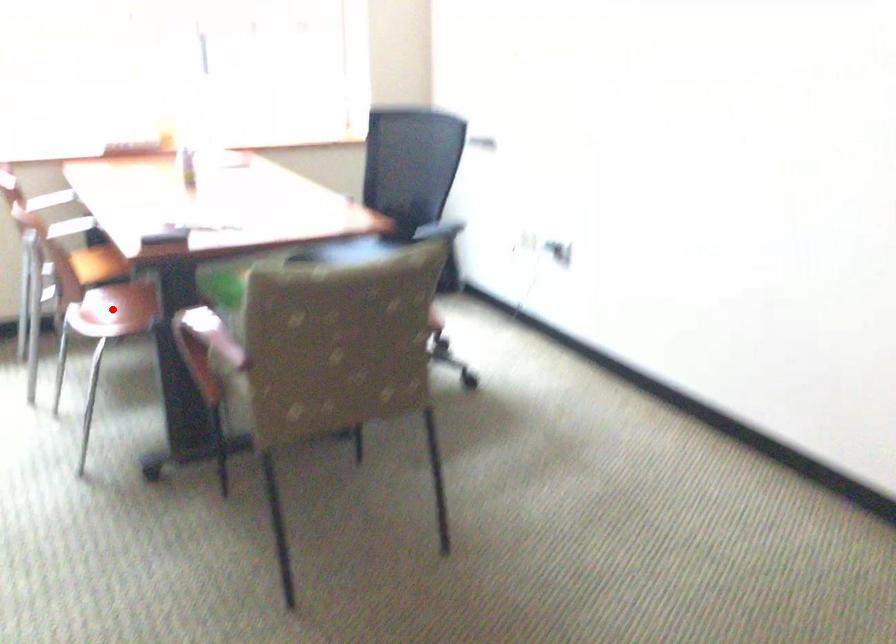
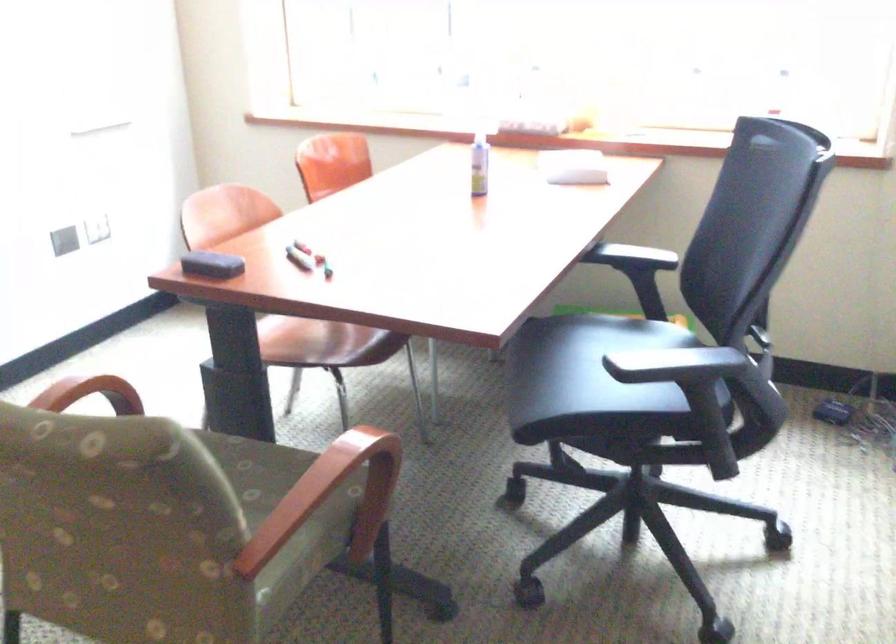
The point at the highlighted location is marked in the first image. Where is the corresponding point in the second image?

(295, 336)